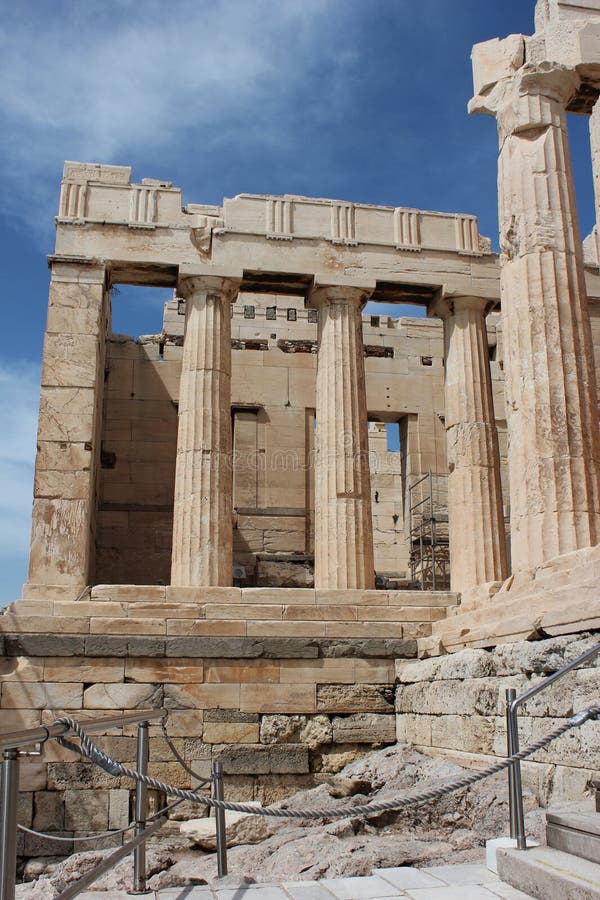
What are the coordinates of `stairs` in the screenshot? It's located at (515, 871), (589, 824).